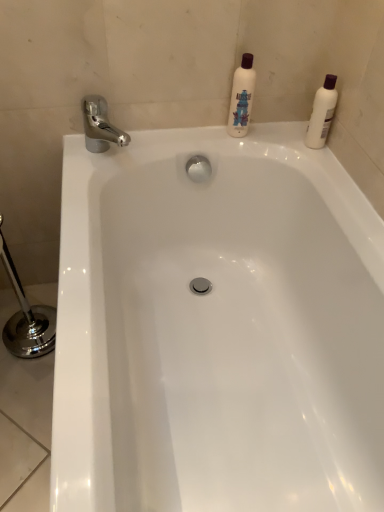
The image size is (384, 512). I want to click on vacant space to the left of chrome metallic faucet at upper left, so click(x=78, y=148).